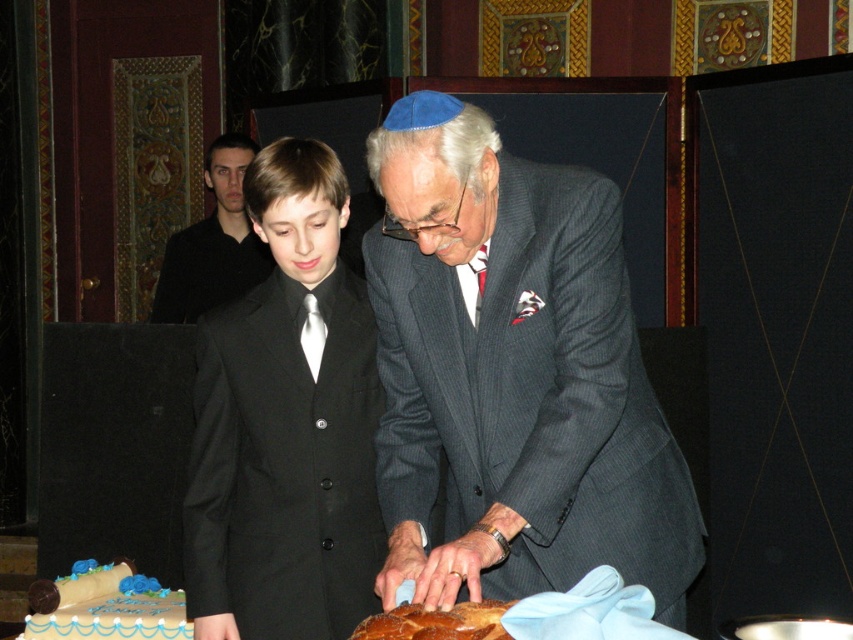
Which is below, matte gray suit at center or black satin suit at center?

black satin suit at center is lower down.

Who is positioned more to the right, matte gray suit at center or black satin suit at center?

From the viewer's perspective, matte gray suit at center appears more on the right side.

Between point (448, 312) and point (341, 440), which one is positioned behind?

Positioned behind is point (341, 440).

Locate an element on the screen. Image resolution: width=853 pixels, height=640 pixels. matte gray suit at center is located at coordinates (514, 374).

Is black suit at left positioned behind blue frosted cake at lower left?

Yes.

Can you confirm if black suit at left is wider than blue frosted cake at lower left?

No.

Where is `black suit at left`? The image size is (853, 640). black suit at left is located at coordinates (213, 243).

Who is higher up, black satin suit at center or blue frosted cake at lower left?

black satin suit at center is higher up.

Is black satin suit at center to the right of blue frosted cake at lower left from the viewer's perspective?

Indeed, black satin suit at center is positioned on the right side of blue frosted cake at lower left.

Which is behind, point (363, 548) or point (115, 632)?

The point (115, 632) is more distant.

Locate an element on the screen. The height and width of the screenshot is (640, 853). black satin suit at center is located at coordinates (286, 424).